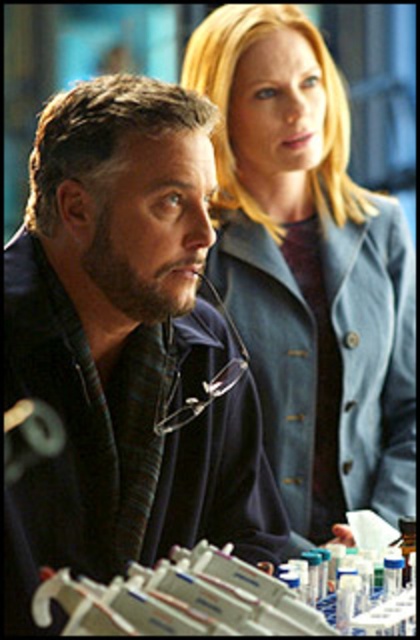
You are a fashion designer who needs to create a new line of jackets. You observe the dark blue textured jacket at center and the denim jacket at upper right in the image. Which jacket would you choose to base your design on if you want to create a larger jacket?

The denim jacket at upper right is larger than the dark blue textured jacket at center, so you should choose the denim jacket at upper right to base your design on if you want to create a larger jacket.